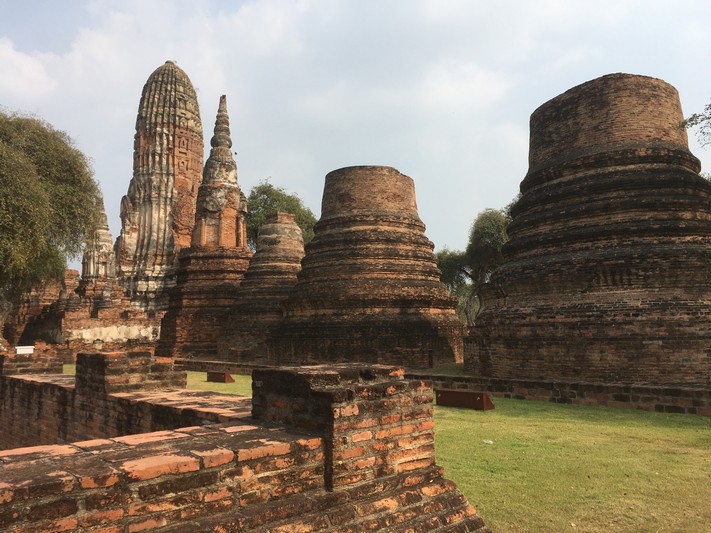
You are a GUI agent. You are given a task and a screenshot of the screen. Output one action in this format:
    pyautogui.click(x=<x>, y=<y>)
    Task: Click on the wall
    
    Given the screenshot: What is the action you would take?
    pyautogui.click(x=193, y=415)